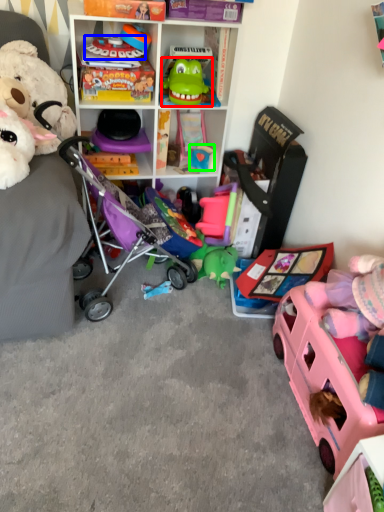
Question: Considering the real-world distances, which object is closest to toy (highlighted by a red box)? toy (highlighted by a blue box) or toy (highlighted by a green box).

Choices:
 (A) toy
 (B) toy

Answer: (A)